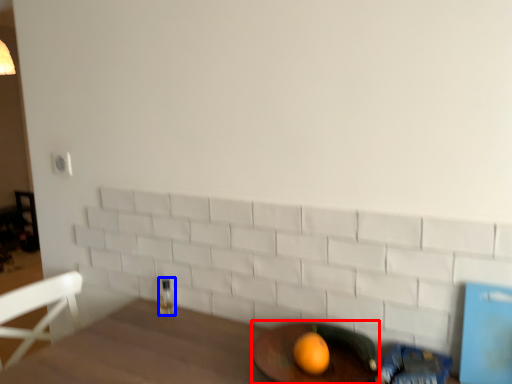
Question: Which point is closer to the camera, round table (highlighted by a red box) or beverage (highlighted by a blue box)?

Choices:
 (A) round table
 (B) beverage

Answer: (A)